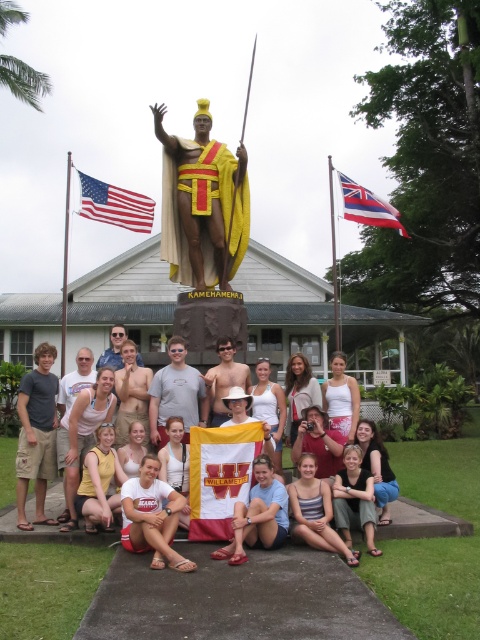
Is bronze statue at center below gray t-shirt at center?

No.

Can you confirm if bronze statue at center is taller than gray t-shirt at center?

Yes, bronze statue at center is taller than gray t-shirt at center.

What do you see at coordinates (211, 228) in the screenshot?
I see `bronze statue at center` at bounding box center [211, 228].

Where is `bronze statue at center`? This screenshot has width=480, height=640. bronze statue at center is located at coordinates (211, 228).

Is tan cargo shorts at center above shiny gold necklace at center?

No.

Is point (36, 465) closer to viewer compared to point (118, 392)?

Yes, it is in front of point (118, 392).

Is point (21, 467) positioned behind point (122, 410)?

No, it is not.

The height and width of the screenshot is (640, 480). I want to click on tan cargo shorts at center, so click(x=36, y=433).

Is bronze statue at center below tan cargo shorts at center?

No.

Where is `bronze statue at center`? The image size is (480, 640). bronze statue at center is located at coordinates (211, 228).